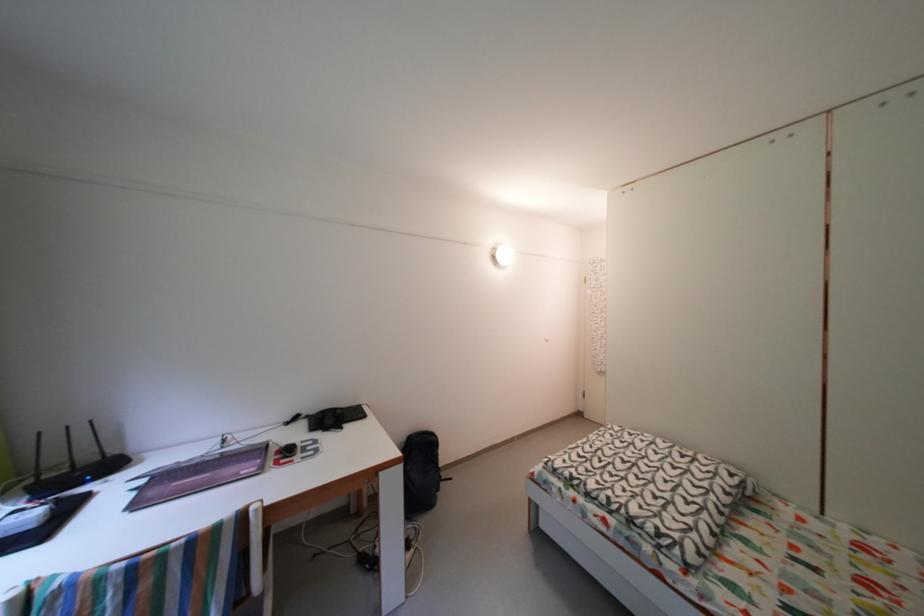
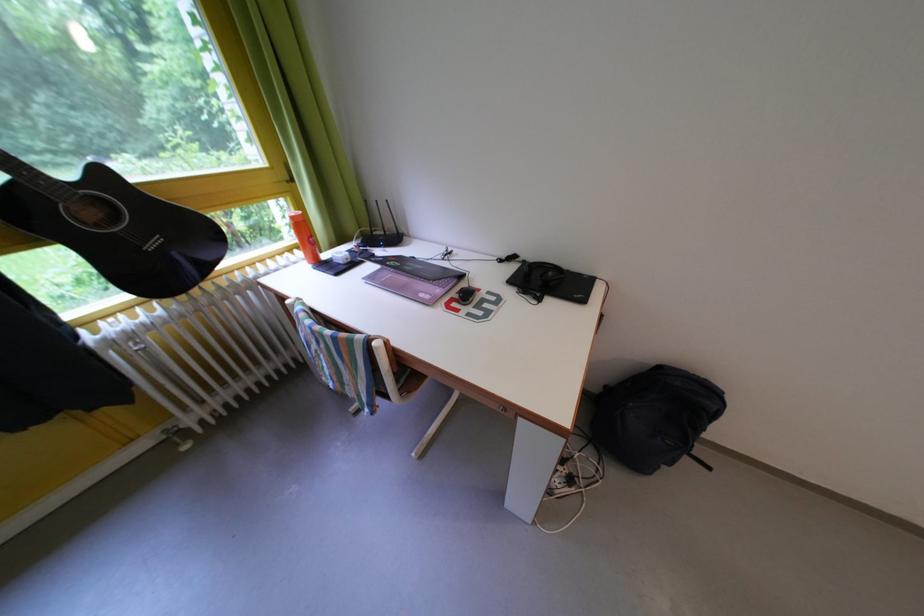
Based on the continuous images, in which direction is the camera rotating?

The rotation direction of the camera is left-down.